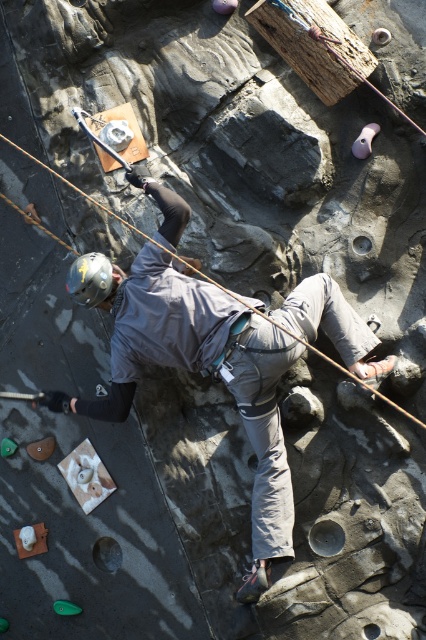
Can you confirm if gray fabric jacket at center is positioned to the right of matte gray helmet at center?

Correct, you'll find gray fabric jacket at center to the right of matte gray helmet at center.

Is gray fabric jacket at center bigger than matte gray helmet at center?

Correct, gray fabric jacket at center is larger in size than matte gray helmet at center.

Between point (259, 365) and point (80, 266), which one is positioned behind?

Point (80, 266)

The height and width of the screenshot is (640, 426). I want to click on gray fabric jacket at center, so click(x=227, y=369).